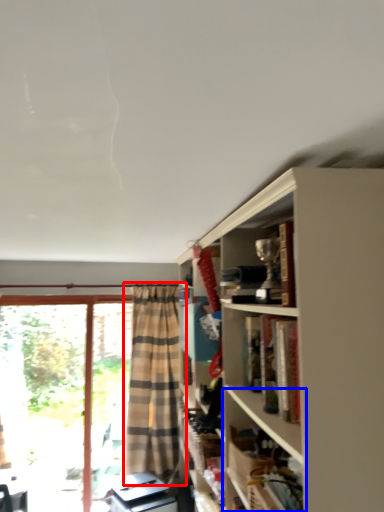
Question: Which object appears farthest to the camera in this image, curtain (highlighted by a red box) or shelf (highlighted by a blue box)?

Choices:
 (A) curtain
 (B) shelf

Answer: (A)